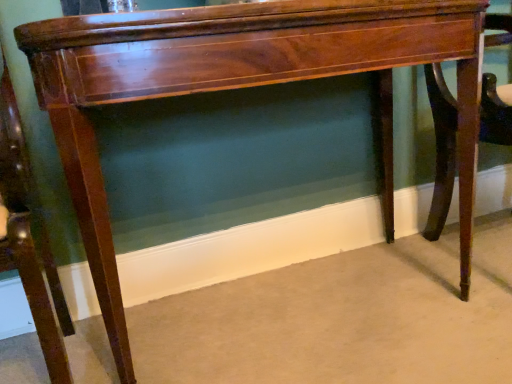
Locate an element on the screen. The image size is (512, 384). mahogany wood armchair at left is located at coordinates (30, 237).

The image size is (512, 384). Describe the element at coordinates (30, 237) in the screenshot. I see `mahogany wood armchair at left` at that location.

I want to click on mahogany wood armchair at left, so click(30, 237).